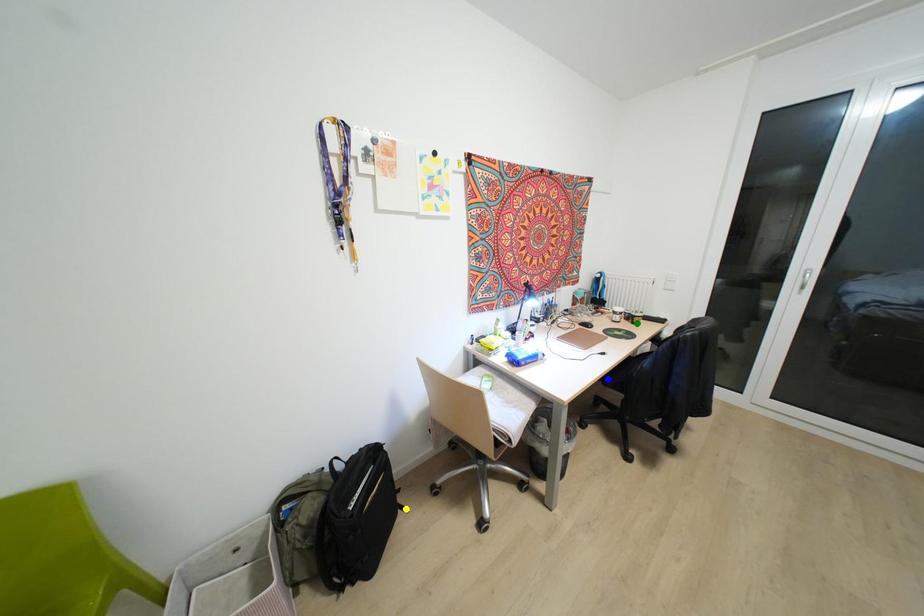
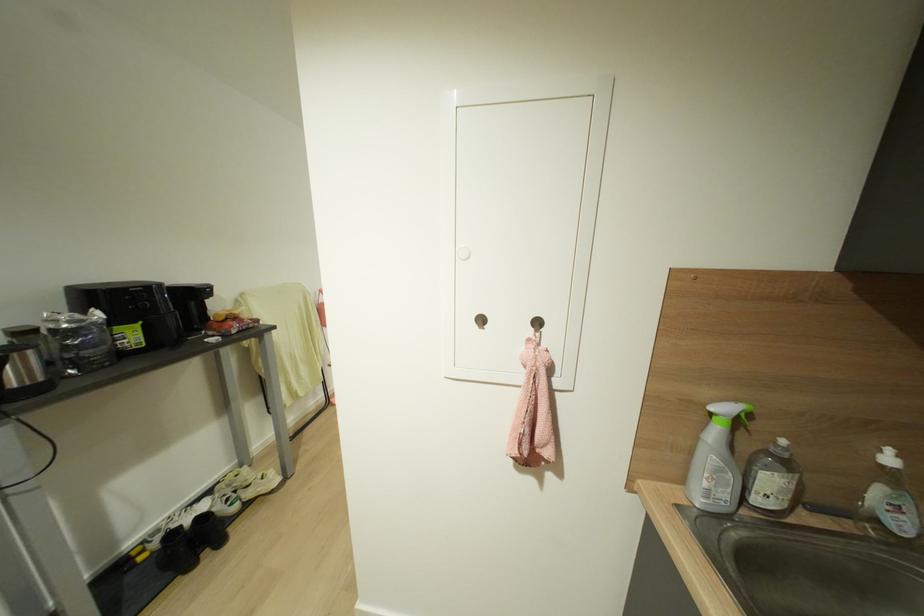
I am providing you with two images of the same scene from different viewpoints. Three points are marked in image1. Which point corresponds to a part or object that is occluded in image2?In image1, three points are marked. Which of them correspond to a part or object that is occluded in image2?Among the three points shown in image1, which one corresponds to a part or object that is no longer visible due to occlusion in image2?

yellow point, green point, blue point cannot be seen in image2.